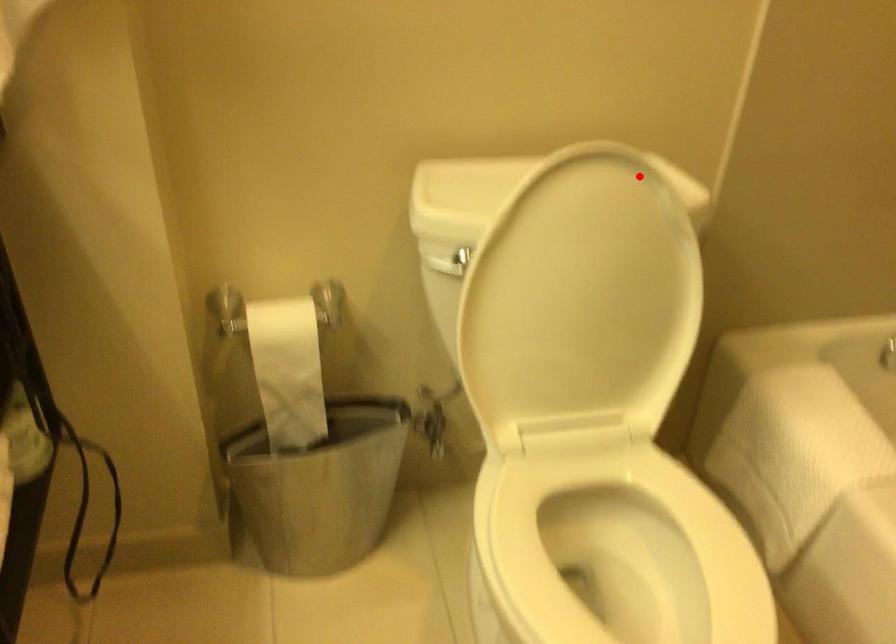
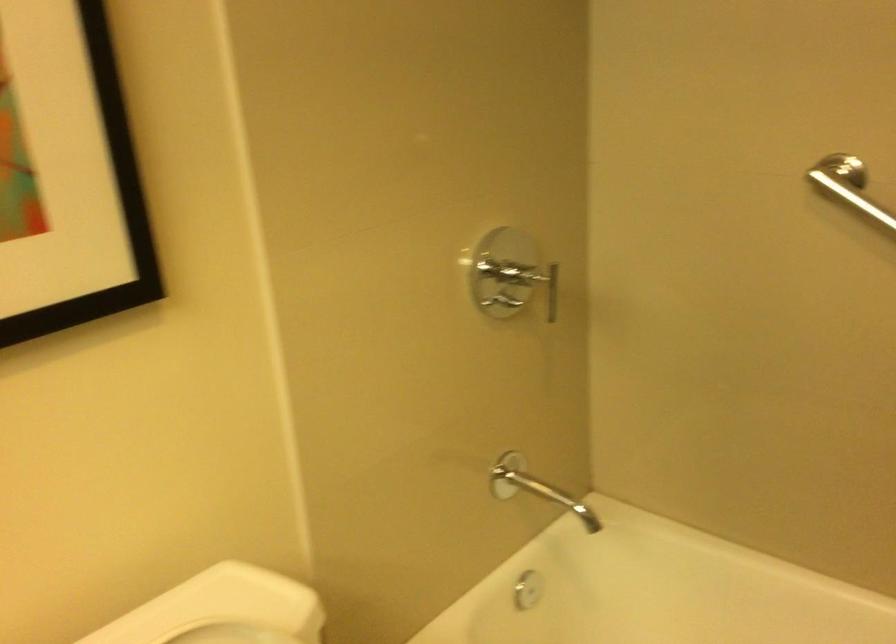
In the second image, find the point that corresponds to the highlighted location in the first image.

(231, 634)